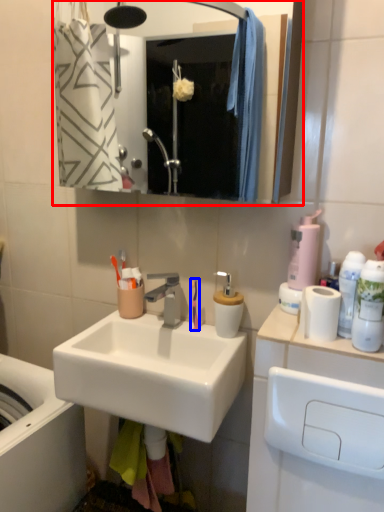
Question: Among these objects, which one is farthest to the camera, mirror (highlighted by a red box) or toothbrush (highlighted by a blue box)?

Choices:
 (A) mirror
 (B) toothbrush

Answer: (B)